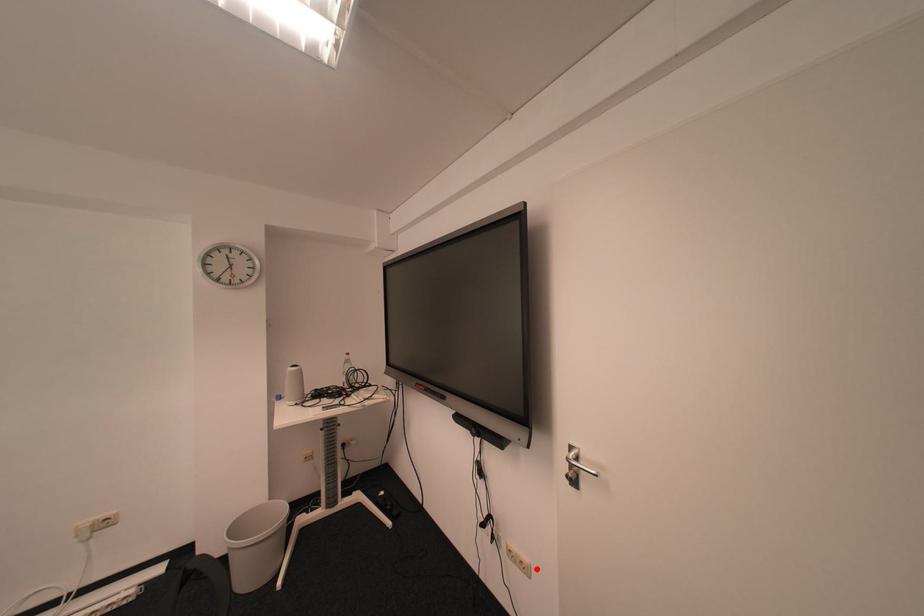
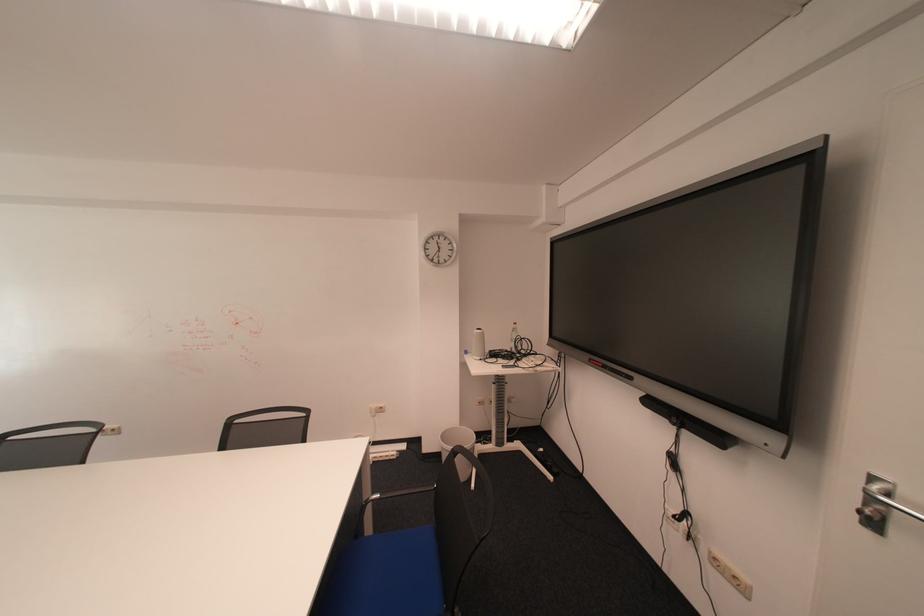
Question: I am providing you with two images of the same scene from different viewpoints. Given a red point in image1, look at the same physical point in image2. Is it:

Choices:
 (A) Closer to the viewpoint
 (B) Farther from the viewpoint

Answer: (A)